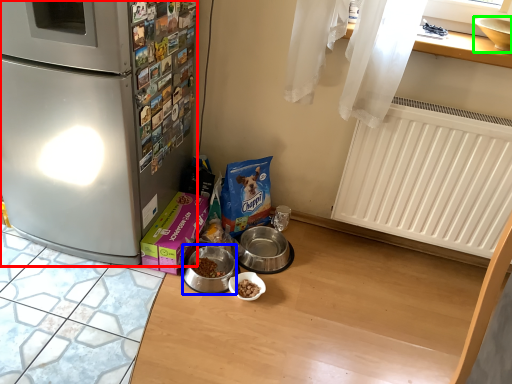
Question: Estimate the real-world distances between objects in this image. Which object is closer to refrigerator (highlighted by a red box), appliance (highlighted by a blue box) or appliance (highlighted by a green box)?

Choices:
 (A) appliance
 (B) appliance

Answer: (A)